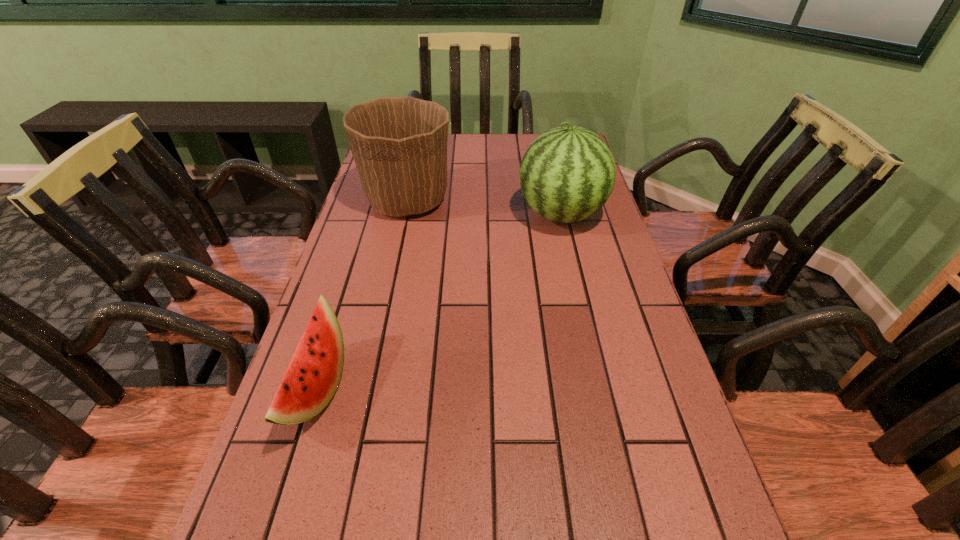
Find the location of a particular element. This screenshot has height=540, width=960. the rightmost object is located at coordinates (567, 174).

Find the location of a particular element. The image size is (960, 540). the taller watermelon is located at coordinates (567, 174).

The image size is (960, 540). In order to click on flowerpot in this screenshot , I will do `click(399, 144)`.

Where is `the shortest object`? the shortest object is located at coordinates (313, 375).

At what (x,y) coordinates should I click in order to perform the action: click on the left watermelon. Please return your answer as a coordinate pair (x, y). Looking at the image, I should click on (313, 375).

Where is `free region located on the left of the farther watermelon`? The image size is (960, 540). free region located on the left of the farther watermelon is located at coordinates (401, 214).

Locate an element on the screen. The height and width of the screenshot is (540, 960). blank area located 0.240m on the back of the flowerpot is located at coordinates (420, 143).

At what (x,y) coordinates should I click in order to perform the action: click on free region located on the outer rind of the shorter watermelon. Please return your answer as a coordinate pair (x, y). The width and height of the screenshot is (960, 540). Looking at the image, I should click on (540, 389).

At what (x,y) coordinates should I click in order to perform the action: click on flowerpot that is positioned at the left edge. Please return your answer as a coordinate pair (x, y). Looking at the image, I should click on (399, 144).

Image resolution: width=960 pixels, height=540 pixels. In order to click on watermelon positioned at the left edge in this screenshot , I will do `click(313, 375)`.